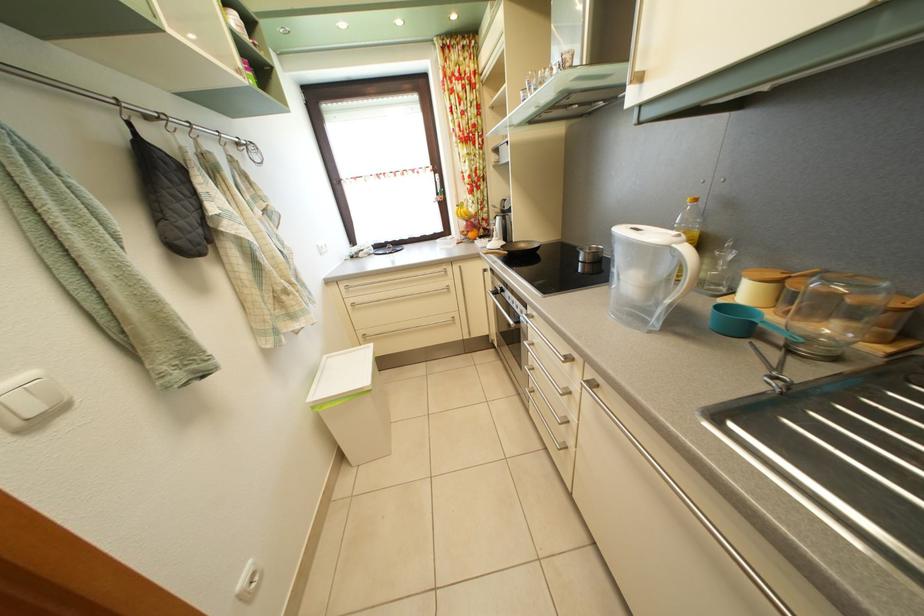
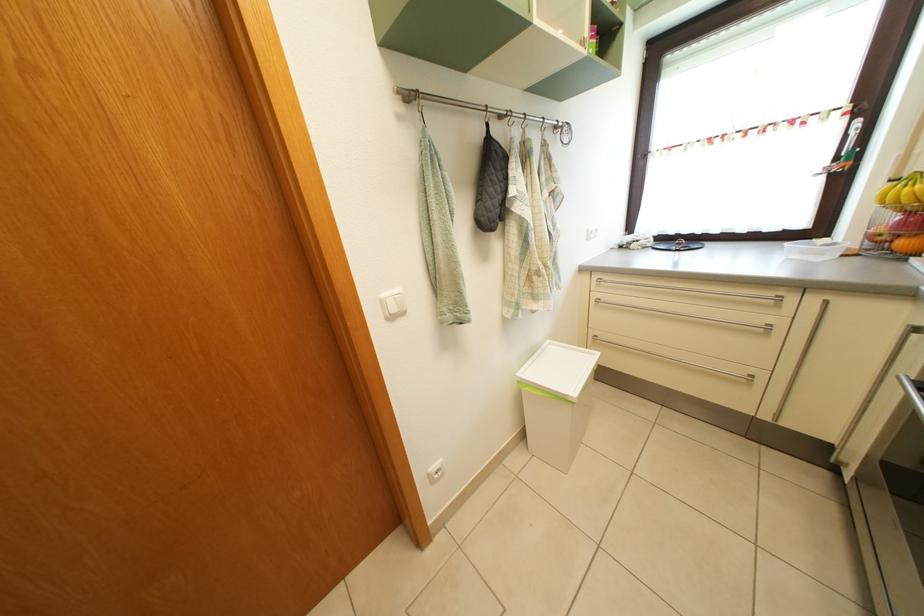
Find the pixel in the second image that matches [479,243] in the first image.

(910, 252)